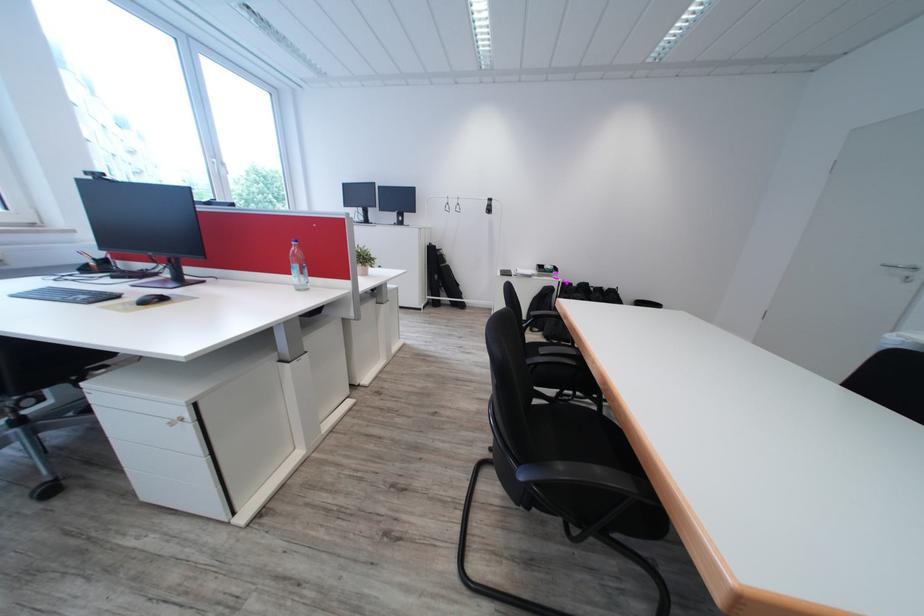
Where would you turn the cabinet drawer key? Please return your answer as a coordinate pair (x, y).

(179, 419)